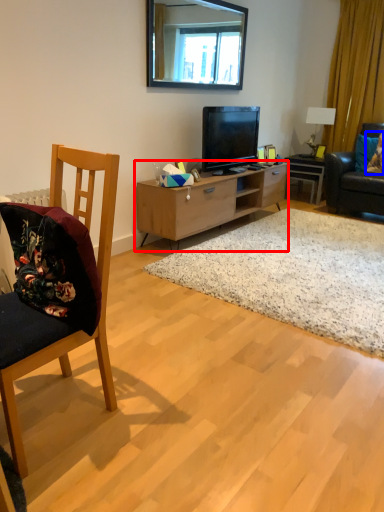
Question: Which object is closer to the camera taking this photo, cabinetry (highlighted by a red box) or pillow (highlighted by a blue box)?

Choices:
 (A) cabinetry
 (B) pillow

Answer: (A)